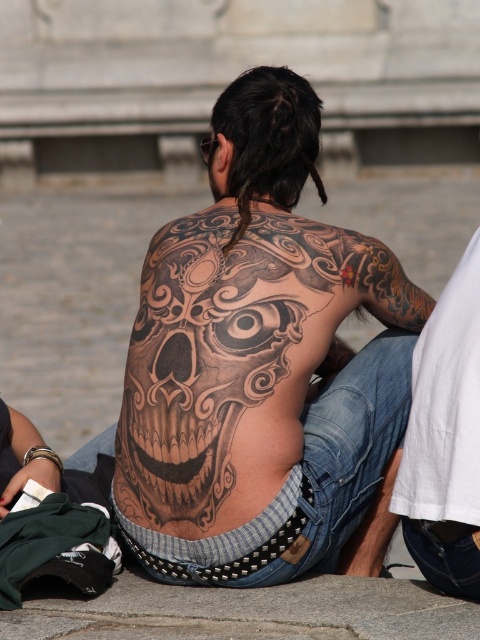
You are an artist trying to sketch the tattoo on the person sitting outdoors. Based on the scene, where exactly is the black tattooed skull at center positioned on the person?

The black tattooed skull at center is located at point coordinates of 0.567 on the x axis and 0.540 on the y axis.

You are a photographer trying to capture the tattoo details of the black tattooed skull at center and the black tattooed skin at right. Given that your camera has a maximum focus range of 5 meters, will you be able to focus on both tattoos simultaneously?

The black tattooed skull at center is 4.91 meters from the black tattooed skin at right, which is within the camera maximum focus range of 5 meters. Therefore, you can focus on both tattoos simultaneously.

In the scene shown: You are an artist trying to sketch the tattoo on the person. You notice two parts of the tattoo, the black tattooed skull at center and the black tattooed skin at right. Which part of the tattoo is located more to the left?

The black tattooed skull at center is positioned more to the left than the black tattooed skin at right.